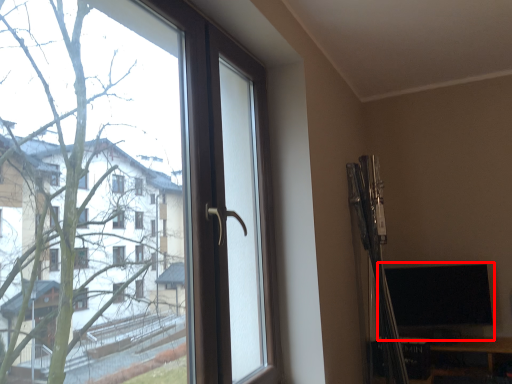
Question: From the image's perspective, what is the correct spatial relationship of computer monitor (annotated by the red box) in relation to window?

Choices:
 (A) below
 (B) above

Answer: (A)